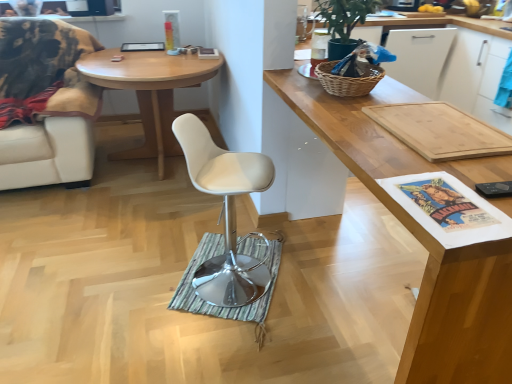
Question: Does green striped mat at center have a greater height compared to woven wicker picnic basket at upper right?

Choices:
 (A) yes
 (B) no

Answer: (B)

Question: From a real-world perspective, is green striped mat at center over woven wicker picnic basket at upper right?

Choices:
 (A) no
 (B) yes

Answer: (A)

Question: Is green striped mat at center completely or partially outside of woven wicker picnic basket at upper right?

Choices:
 (A) yes
 (B) no

Answer: (A)

Question: Would you consider green striped mat at center to be distant from woven wicker picnic basket at upper right?

Choices:
 (A) yes
 (B) no

Answer: (A)

Question: From the image's perspective, is green striped mat at center beneath woven wicker picnic basket at upper right?

Choices:
 (A) yes
 (B) no

Answer: (A)

Question: From the image's perspective, is wooden cutting board at upper right positioned above or below woven wicker picnic basket at upper right?

Choices:
 (A) below
 (B) above

Answer: (A)

Question: Is point click(453, 375) positioned closer to the camera than point click(327, 82)?

Choices:
 (A) closer
 (B) farther

Answer: (A)

Question: Considering the positions of wooden cutting board at upper right and woven wicker picnic basket at upper right in the image, is wooden cutting board at upper right taller or shorter than woven wicker picnic basket at upper right?

Choices:
 (A) tall
 (B) short

Answer: (A)

Question: Is wooden cutting board at upper right bigger or smaller than woven wicker picnic basket at upper right?

Choices:
 (A) big
 (B) small

Answer: (A)

Question: From a real-world perspective, relative to green striped mat at center, is green matte plant at upper right vertically above or below?

Choices:
 (A) below
 (B) above

Answer: (B)

Question: Based on their sizes in the image, would you say green matte plant at upper right is bigger or smaller than green striped mat at center?

Choices:
 (A) small
 (B) big

Answer: (B)

Question: From the image's perspective, is green matte plant at upper right located above or below green striped mat at center?

Choices:
 (A) below
 (B) above

Answer: (B)

Question: Visually, is green matte plant at upper right positioned to the left or to the right of green striped mat at center?

Choices:
 (A) right
 (B) left

Answer: (A)

Question: In the image, is light wood desk at center on the left side or the right side of white leather chair at left?

Choices:
 (A) right
 (B) left

Answer: (A)

Question: Based on their sizes in the image, would you say light wood desk at center is bigger or smaller than white leather chair at left?

Choices:
 (A) big
 (B) small

Answer: (B)